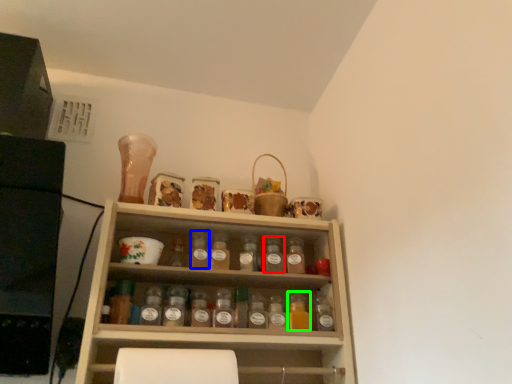
Question: Considering the real-world distances, which object is farthest from bottle (highlighted by a red box)? bottle (highlighted by a blue box) or bottle (highlighted by a green box)?

Choices:
 (A) bottle
 (B) bottle

Answer: (A)